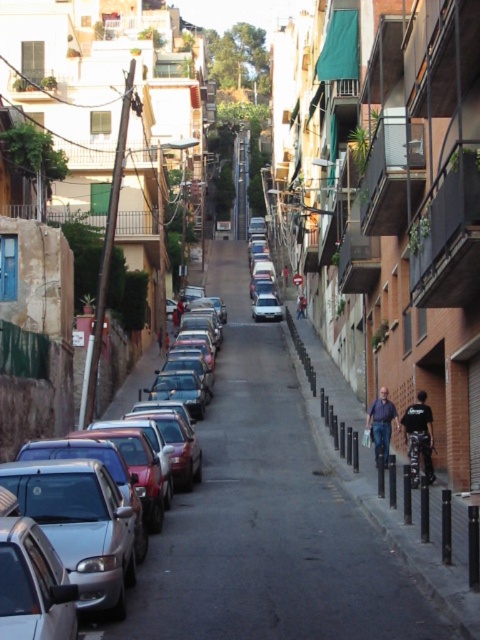
You are standing at the entrance of the street and want to find the black leather jacket at lower right. According to the coordinates given, in which direction should you look to locate it?

The black leather jacket at lower right is located at coordinates point (419,436), which means it is positioned towards the lower right side of the scene. Since you are at the entrance, facing the street which slopes upwards, you should look towards the lower right direction to find it.

You are a delivery person needing to place a package on the black leather jacket at lower right. The shiny silver sedan at left is blocking the path. Can you reach the jacket without moving the car?

The shiny silver sedan at left is located below the black leather jacket at lower right, so you can reach the jacket without moving the car by going around the sedan.

You are a photographer standing on the street and want to take a photo of both the black leather jacket at lower right and the dark blue jeans at right. Which object should you focus on first to ensure both are in sharp focus?

You should focus on the black leather jacket at lower right first because it is closer to you than the dark blue jeans at right. By focusing on the closer object, the farther one may still be in focus depending on the depth of field.